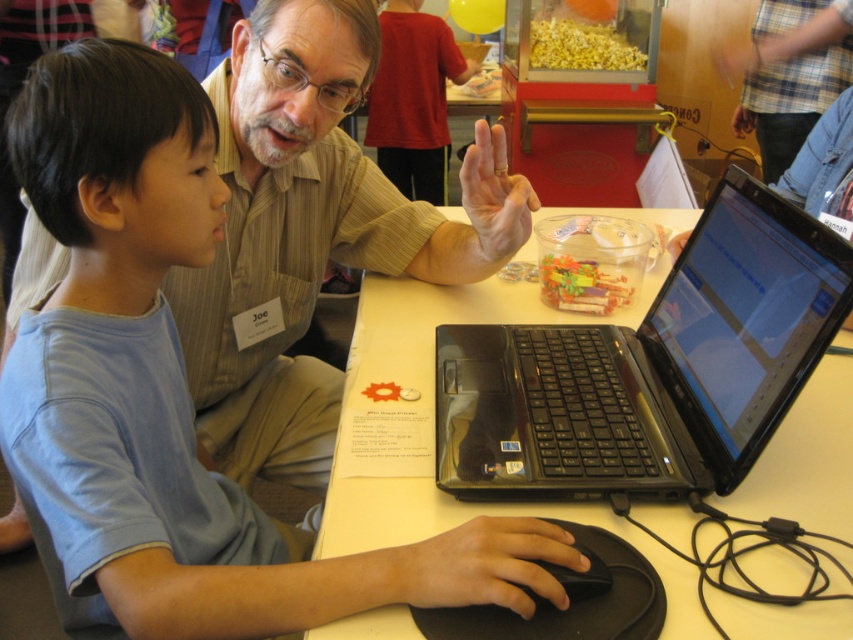
Question: In this image, where is light blue cotton shirt at center located relative to white glossy table at center?

Choices:
 (A) left
 (B) right

Answer: (A)

Question: Based on their relative distances, which object is farther from the black plastic laptop at center?

Choices:
 (A) black matte mouse at lower center
 (B) light blue cotton shirt at center

Answer: (B)

Question: Is white glossy table at center to the left of black matte mouse at lower center from the viewer's perspective?

Choices:
 (A) no
 (B) yes

Answer: (A)

Question: Which object is positioned farthest from the black matte mouse at lower center?

Choices:
 (A) black plastic laptop at center
 (B) light blue cotton shirt at center

Answer: (B)

Question: Does light blue cotton shirt at center appear over black plastic laptop at center?

Choices:
 (A) yes
 (B) no

Answer: (A)

Question: Considering the real-world distances, which object is farthest from the white glossy table at center?

Choices:
 (A) black matte mouse at lower center
 (B) black plastic laptop at center

Answer: (A)